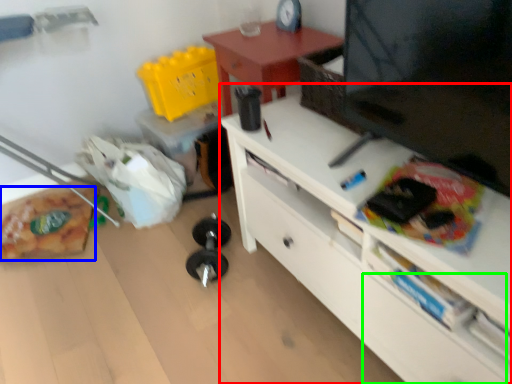
Question: Which object is the closest to the desk (highlighted by a red box)? Choose among these: stuff (highlighted by a blue box) or drawer (highlighted by a green box).

Choices:
 (A) stuff
 (B) drawer

Answer: (B)